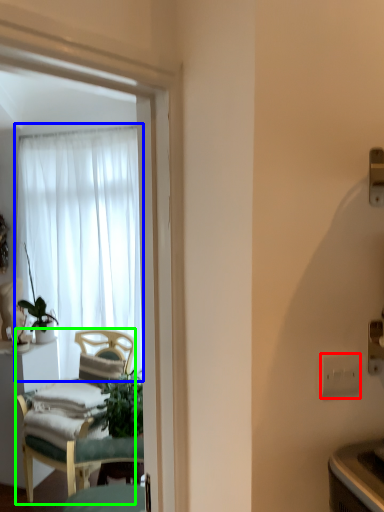
Question: Which object is positioned farthest from electric outlet (highlighted by a red box)? Select from curtain (highlighted by a blue box) and chair (highlighted by a green box).

Choices:
 (A) curtain
 (B) chair

Answer: (A)